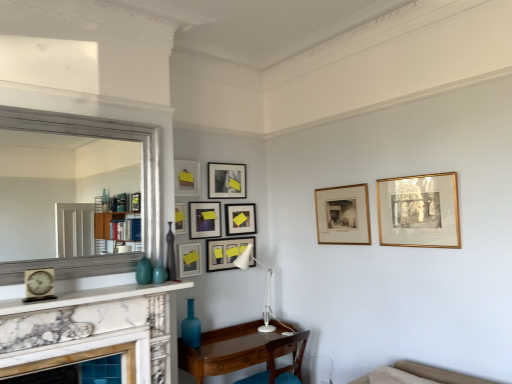
Question: Considering the relative sizes of white wall at center and matte gold picture frame at upper center, the second picture frame positioned from the left, in the image provided, is white wall at center wider than matte gold picture frame at upper center, the second picture frame positioned from the left,?

Choices:
 (A) yes
 (B) no

Answer: (A)

Question: Is white wall at center facing towards matte gold picture frame at upper center, placed as the 8th picture frame when sorted from right to left?

Choices:
 (A) no
 (B) yes

Answer: (B)

Question: Does white wall at center have a larger size compared to matte gold picture frame at upper center, the second picture frame positioned from the left?

Choices:
 (A) yes
 (B) no

Answer: (A)

Question: Could matte gold picture frame at upper center, the second picture frame positioned from the left, be considered to be inside white wall at center?

Choices:
 (A) yes
 (B) no

Answer: (B)

Question: Considering the relative positions of white wall at center and matte gold picture frame at upper center, the second picture frame positioned from the left, in the image provided, is white wall at center in front of matte gold picture frame at upper center, the second picture frame positioned from the left,?

Choices:
 (A) no
 (B) yes

Answer: (B)

Question: Does white wall at center touch matte gold picture frame at upper center, the second picture frame positioned from the left?

Choices:
 (A) no
 (B) yes

Answer: (A)

Question: Are brown wooden chair at lower center and matte black picture frame at center, the 6th picture frame when ordered from left to right, beside each other?

Choices:
 (A) no
 (B) yes

Answer: (A)

Question: Does brown wooden chair at lower center come in front of matte black picture frame at center, the 6th picture frame when ordered from left to right?

Choices:
 (A) yes
 (B) no

Answer: (A)

Question: Is brown wooden chair at lower center smaller than matte black picture frame at center, the 4th picture frame in the right-to-left sequence?

Choices:
 (A) no
 (B) yes

Answer: (A)

Question: Does brown wooden chair at lower center have a lesser height compared to matte black picture frame at center, the 4th picture frame in the right-to-left sequence?

Choices:
 (A) yes
 (B) no

Answer: (B)

Question: Is brown wooden chair at lower center behind matte black picture frame at center, the 4th picture frame in the right-to-left sequence?

Choices:
 (A) yes
 (B) no

Answer: (B)

Question: Can you confirm if brown wooden chair at lower center is thinner than matte black picture frame at center, the 6th picture frame when ordered from left to right?

Choices:
 (A) no
 (B) yes

Answer: (A)

Question: Considering the relative positions of gold framed print at upper right, the 9th picture frame viewed from the left, and matte ceramic vase at center, arranged as the first turquoise when viewed from the right, in the image provided, is gold framed print at upper right, the 9th picture frame viewed from the left, to the left of matte ceramic vase at center, arranged as the first turquoise when viewed from the right, from the viewer's perspective?

Choices:
 (A) yes
 (B) no

Answer: (B)